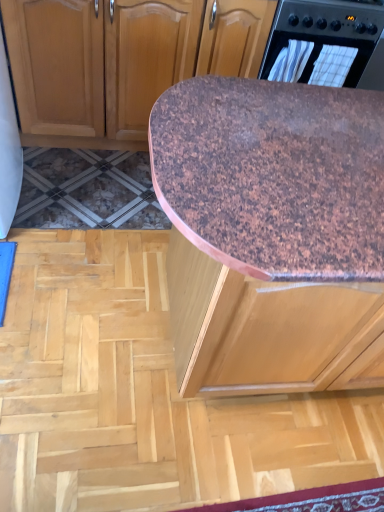
Find the location of a particular element. Image resolution: width=384 pixels, height=512 pixels. vacant area on top of brown speckled granite countertop at center (from a real-world perspective) is located at coordinates (297, 143).